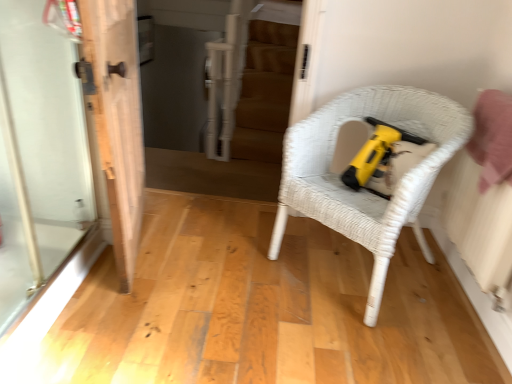
Locate an element on the screen. This screenshot has width=512, height=384. free point in front of white wood door at left is located at coordinates pyautogui.click(x=136, y=323).